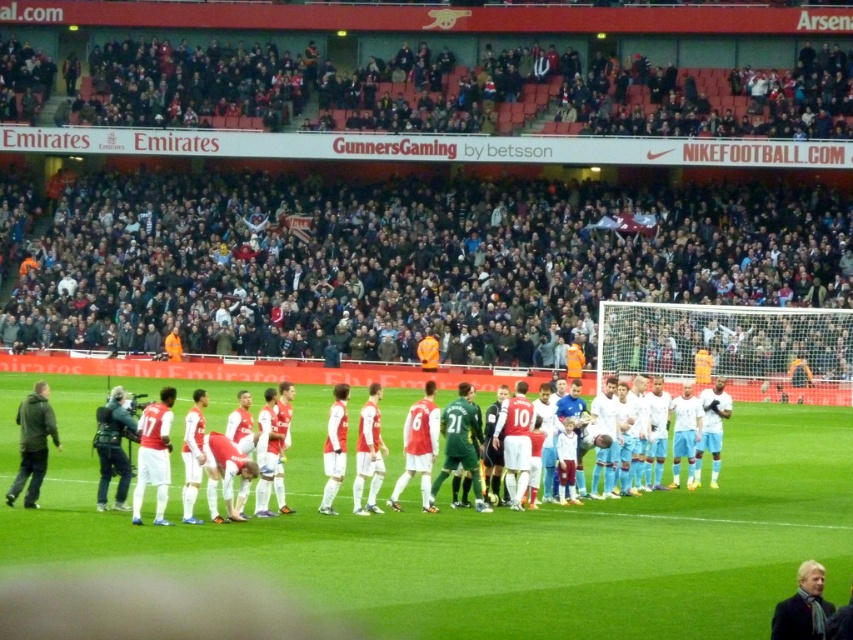
Question: Is white smooth soccer team at center above white wool scarf at lower right?

Choices:
 (A) yes
 (B) no

Answer: (A)

Question: Can you confirm if white smooth soccer team at center is smaller than dark green jacket at left?

Choices:
 (A) yes
 (B) no

Answer: (B)

Question: Is dark green jacket at left above camouflage-patterned jacket at left?

Choices:
 (A) no
 (B) yes

Answer: (A)

Question: Which point is farther to the camera?

Choices:
 (A) (804, 605)
 (B) (392, 486)
 (C) (103, 554)
 (D) (126, 422)

Answer: (B)

Question: Which of the following is the closest to the observer?

Choices:
 (A) (41, 422)
 (B) (819, 584)
 (C) (669, 595)

Answer: (B)

Question: Which of the following is the farthest from the observer?

Choices:
 (A) (814, 596)
 (B) (61, 403)
 (C) (80, 413)
 (D) (93, 444)

Answer: (B)